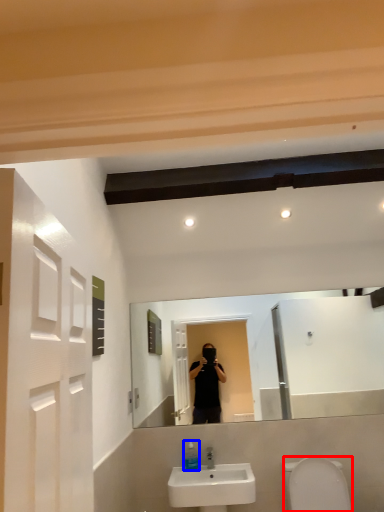
Question: Which object is closer to the camera taking this photo, toilet bowl (highlighted by a red box) or soap dispenser (highlighted by a blue box)?

Choices:
 (A) toilet bowl
 (B) soap dispenser

Answer: (A)